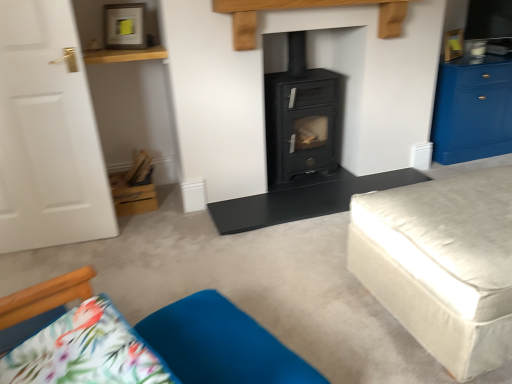
In order to click on vacant area located to the right-hand side of white matte door at left in this screenshot , I will do `click(128, 243)`.